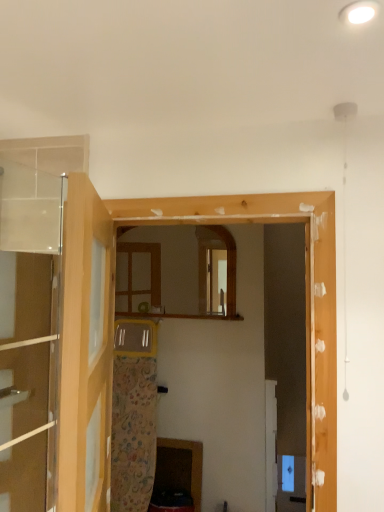
Question: Do you think clear glass door at upper left, placed as the first door when sorted from right to left, is within wooden cabinet at lower center, or outside of it?

Choices:
 (A) inside
 (B) outside

Answer: (B)

Question: From the image's perspective, is clear glass door at upper left, placed as the first door when sorted from right to left, positioned above or below wooden cabinet at lower center?

Choices:
 (A) below
 (B) above

Answer: (B)

Question: Which of these objects is positioned closest to the wooden mirror at center?

Choices:
 (A) wooden frame at center
 (B) clear glass door at upper left, placed as the first door when sorted from right to left
 (C) wooden cabinet at lower center
 (D) transparent glass door at left, the second door from the right

Answer: (C)

Question: Which object is the farthest from the clear glass door at upper left, placed as the first door when sorted from right to left?

Choices:
 (A) transparent glass door at left, which is the 1th door from left to right
 (B) wooden cabinet at lower center
 (C) wooden mirror at center
 (D) wooden frame at center

Answer: (B)